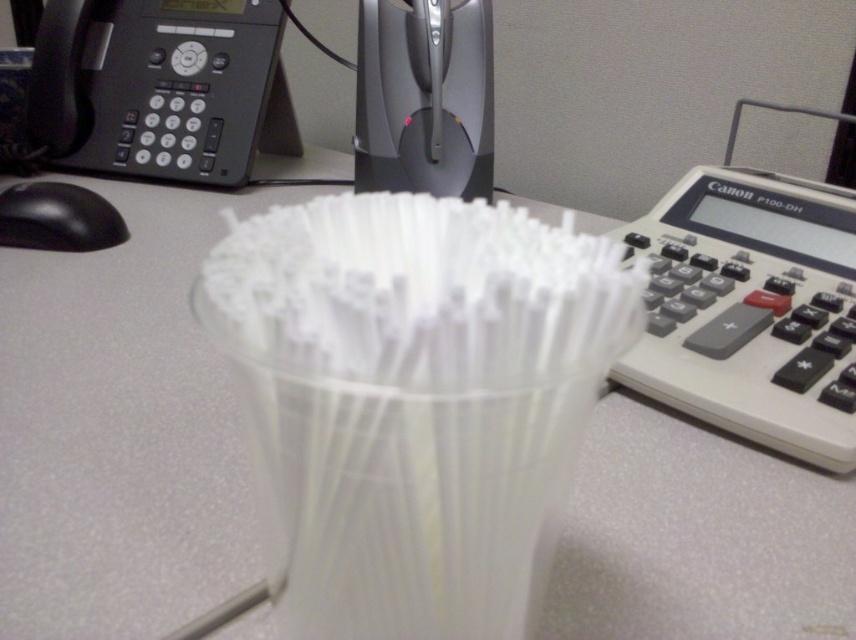
You are organizing items on a desk and need to place the white plastic calculator at right and the black plastic phone at upper left into a drawer. The drawer has a height limit of 2 cm. Which item will not fit based on their thickness?

The black plastic phone at upper left is thicker than the white plastic calculator at right, so it will not fit into the drawer with a 2 cm height limit.

You are organizing items on a desk and need to place a new item between the transparent plastic straws at center and the black plastic phone at upper left. Based on their positions, which item should you place closer to the front of the desk?

You should place the new item closer to the transparent plastic straws at center because they are closer to the viewer than the black plastic phone at upper left.